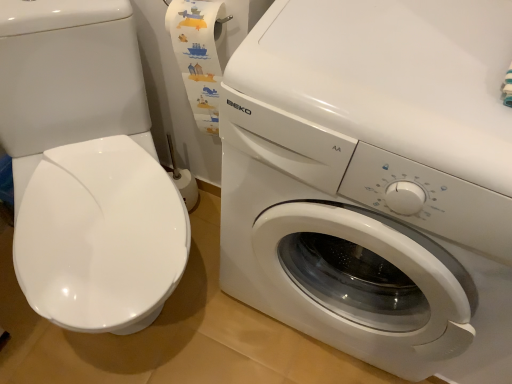
What do you see at coordinates (375, 181) in the screenshot? I see `white glossy washing machine at right` at bounding box center [375, 181].

I want to click on white glossy washing machine at right, so click(x=375, y=181).

Locate an element on the screen. The height and width of the screenshot is (384, 512). white glossy washing machine at right is located at coordinates (375, 181).